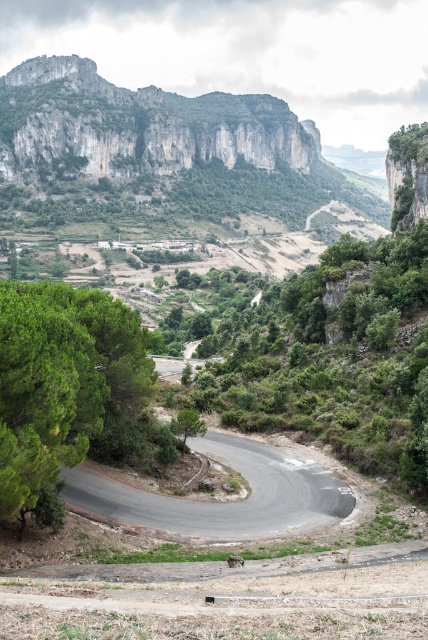
Between point (187, 115) and point (9, 380), which one is positioned behind?

Point (187, 115)

Does rugged stone mountain at upper left have a smaller size compared to green leafy tree at lower left?

Incorrect, rugged stone mountain at upper left is not smaller in size than green leafy tree at lower left.

Is point (142, 148) more distant than point (71, 394)?

Yes, point (142, 148) is behind point (71, 394).

Find the location of a particular element. This screenshot has width=428, height=640. rugged stone mountain at upper left is located at coordinates (136, 124).

Which of these two, green leafy tree at lower left or green leafy tree at center, stands taller?

With more height is green leafy tree at lower left.

Is green leafy tree at lower left thinner than green leafy tree at center?

No, green leafy tree at lower left is not thinner than green leafy tree at center.

The height and width of the screenshot is (640, 428). What are the coordinates of `green leafy tree at lower left` in the screenshot? It's located at (61, 380).

I want to click on green leafy tree at lower left, so click(61, 380).

Consider the image. Does rugged stone mountain at upper left have a smaller size compared to green leafy tree at center?

Actually, rugged stone mountain at upper left might be larger than green leafy tree at center.

Does rugged stone mountain at upper left have a lesser width compared to green leafy tree at center?

No, rugged stone mountain at upper left is not thinner than green leafy tree at center.

Where is `rugged stone mountain at upper left`? This screenshot has height=640, width=428. rugged stone mountain at upper left is located at coordinates (136, 124).